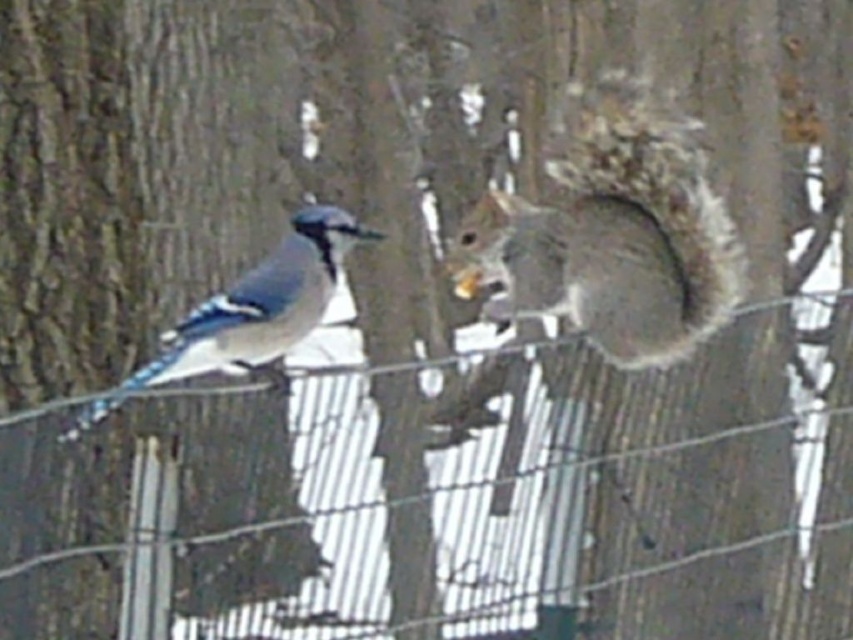
You are a birdwatcher observing the scene. You notice two squirrels on the wire fence. Which squirrel, the fuzzy gray squirrel at center or the gray furry squirrel at left, has a wider body?

The fuzzy gray squirrel at center has a wider body than the gray furry squirrel at left.

You are a photographer trying to capture the blue jay and the squirrel in the winter scene. You notice two points of interest marked as point 1 at coordinates point [532,234] and point 2 at coordinates point [318,221]. Which point is closer to your camera lens?

Point 1 at coordinates point [532,234] is closer to the camera lens than point 2 at coordinates point [318,221] because it is further to the camera.

You are a photographer trying to capture the fuzzy gray squirrel at center. The camera is focused on the point at coordinates point (613, 237). Is the fuzzy gray squirrel at center in focus?

The point (613, 237) indicates fuzzy gray squirrel at center, so yes, the fuzzy gray squirrel at center is in focus.